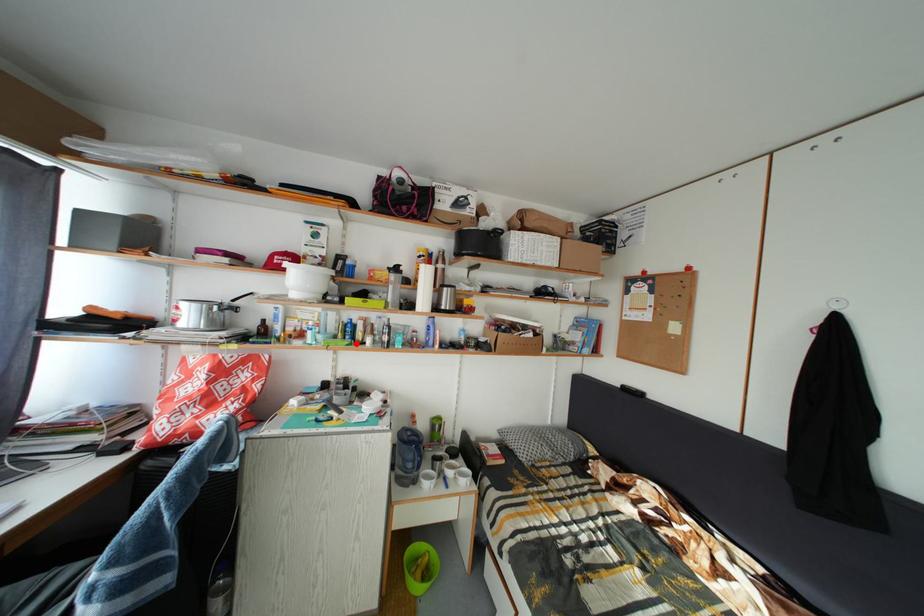
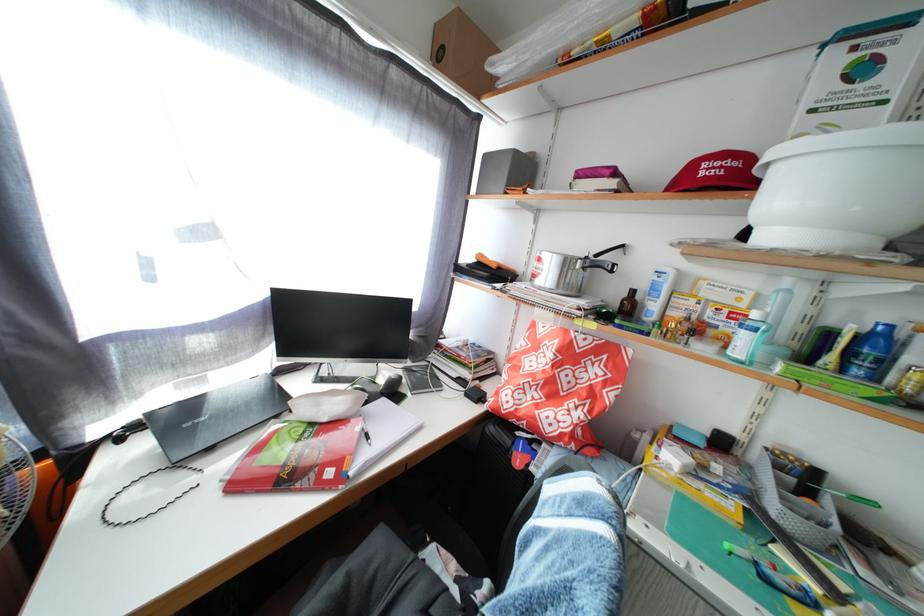
In the second image, find the point that corresponds to the highlighted location in the first image.

(866, 378)